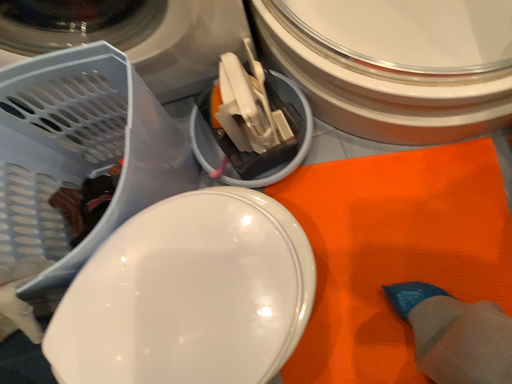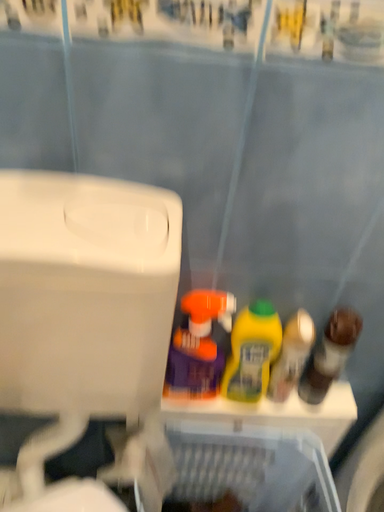
Question: How did the camera likely rotate when shooting the video?

Choices:
 (A) rotated upward
 (B) rotated downward

Answer: (A)